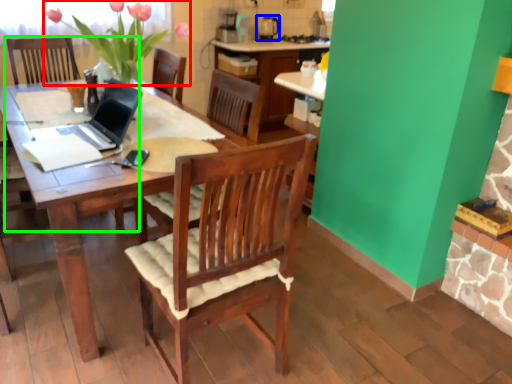
Question: Considering the real-world distances, which object is closest to floral arrangement (highlighted by a red box)? appliance (highlighted by a blue box) or armchair (highlighted by a green box).

Choices:
 (A) appliance
 (B) armchair

Answer: (B)